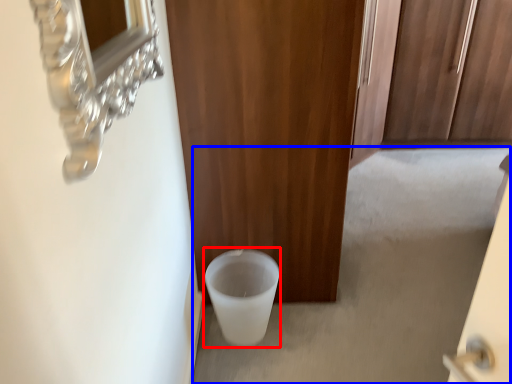
Question: Which point is closer to the camera, toilet bowl (highlighted by a red box) or concrete (highlighted by a blue box)?

Choices:
 (A) toilet bowl
 (B) concrete

Answer: (A)